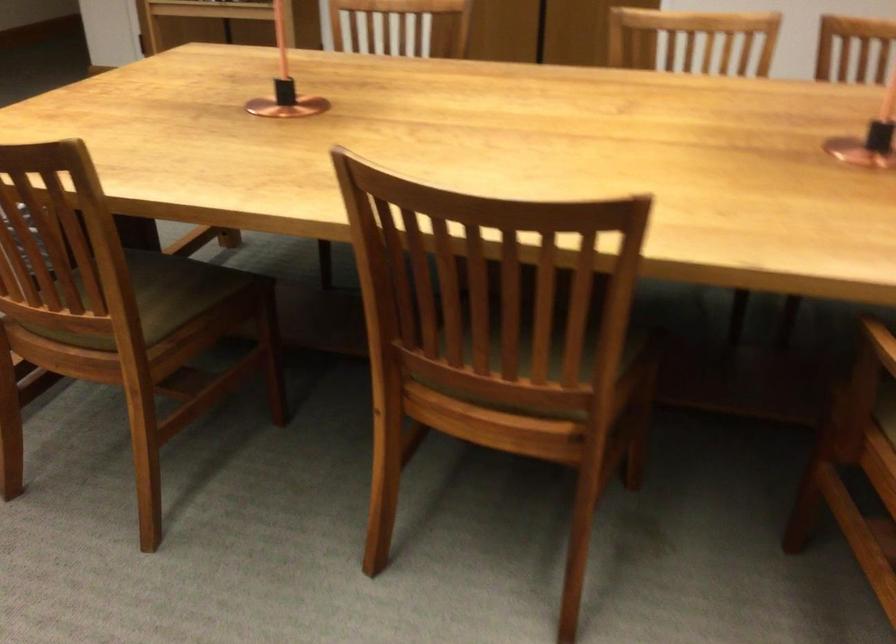
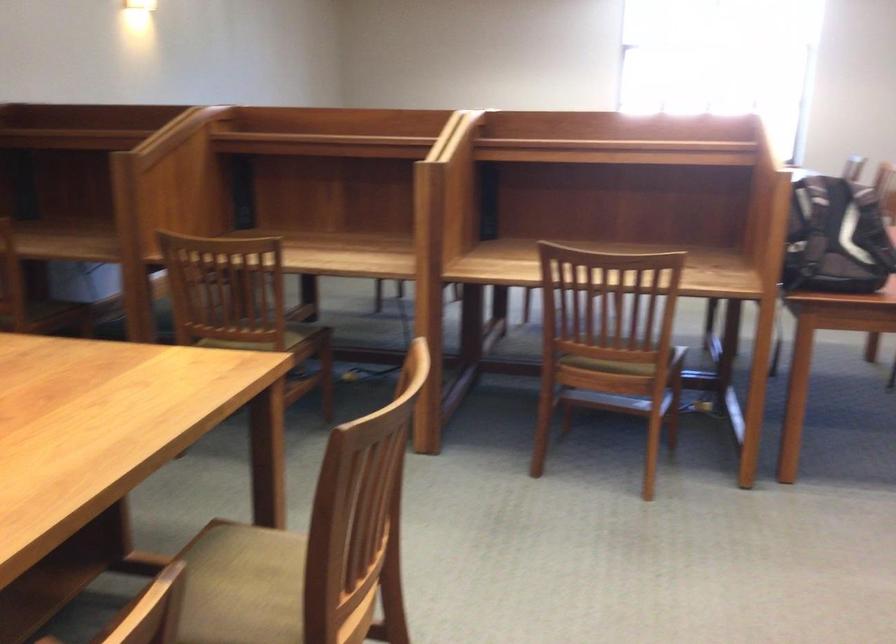
Question: How did the camera likely rotate?

Choices:
 (A) Left
 (B) Right
 (C) Up
 (D) Down

Answer: (A)